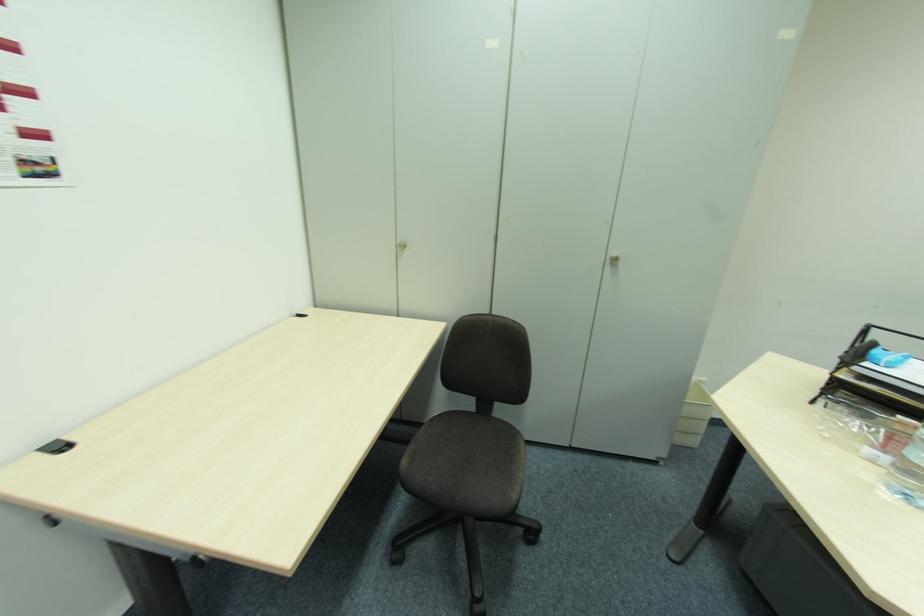
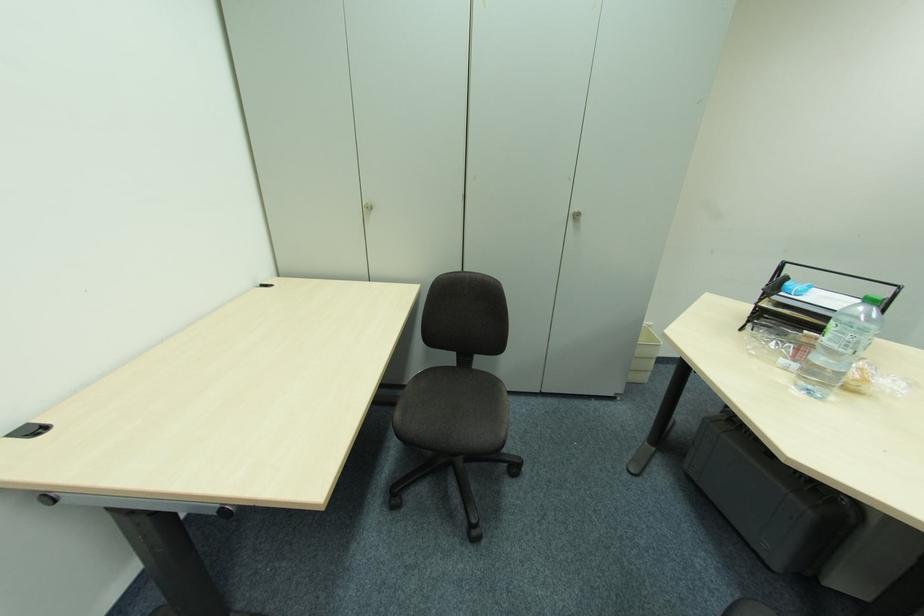
Question: The camera is either moving clockwise (left) or counter-clockwise (right) around the object. The first image is from the beginning of the video and the second image is from the end. Is the camera moving left or right when shooting the video?

Choices:
 (A) Left
 (B) Right

Answer: (A)